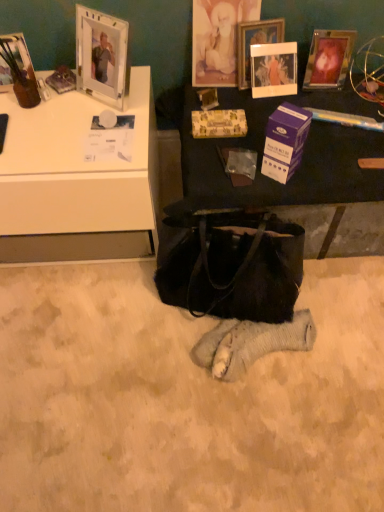
Locate an element on the screen. vacant space to the right of matte glass picture frame at upper left, placed as the first picture frame when sorted from left to right is located at coordinates (61, 108).